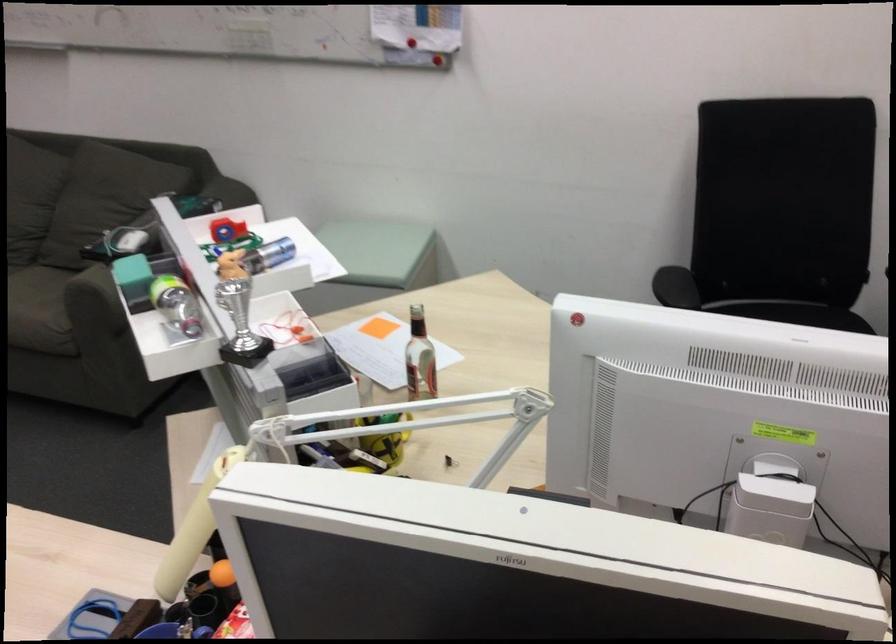
Locate an element on the screen. The width and height of the screenshot is (896, 644). white power adapter is located at coordinates (770, 509).